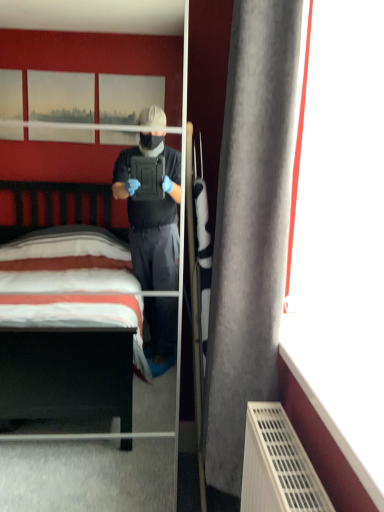
Question: Can you confirm if clear glass mirror at center is smaller than gray fabric curtain at right?

Choices:
 (A) no
 (B) yes

Answer: (A)

Question: Considering the relative sizes of clear glass mirror at center and gray fabric curtain at right in the image provided, is clear glass mirror at center thinner than gray fabric curtain at right?

Choices:
 (A) yes
 (B) no

Answer: (B)

Question: Considering the relative sizes of clear glass mirror at center and gray fabric curtain at right in the image provided, is clear glass mirror at center bigger than gray fabric curtain at right?

Choices:
 (A) no
 (B) yes

Answer: (B)

Question: Is clear glass mirror at center facing away from gray fabric curtain at right?

Choices:
 (A) yes
 (B) no

Answer: (B)

Question: From a real-world perspective, is clear glass mirror at center over gray fabric curtain at right?

Choices:
 (A) no
 (B) yes

Answer: (A)

Question: From a real-world perspective, is clear glass mirror at center physically below gray fabric curtain at right?

Choices:
 (A) no
 (B) yes

Answer: (B)

Question: Is gray fabric curtain at right shorter than clear glass mirror at center?

Choices:
 (A) no
 (B) yes

Answer: (B)

Question: Does gray fabric curtain at right have a lesser width compared to clear glass mirror at center?

Choices:
 (A) yes
 (B) no

Answer: (A)

Question: Is clear glass mirror at center inside gray fabric curtain at right?

Choices:
 (A) no
 (B) yes

Answer: (A)

Question: Are gray fabric curtain at right and clear glass mirror at center located far from each other?

Choices:
 (A) yes
 (B) no

Answer: (A)

Question: From the image's perspective, does gray fabric curtain at right appear higher than clear glass mirror at center?

Choices:
 (A) no
 (B) yes

Answer: (B)

Question: Does gray fabric curtain at right come behind clear glass mirror at center?

Choices:
 (A) no
 (B) yes

Answer: (A)

Question: Is point (49, 465) positioned closer to the camera than point (251, 345)?

Choices:
 (A) closer
 (B) farther

Answer: (B)